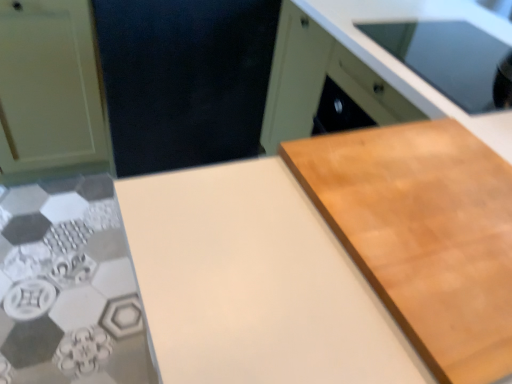
Question: Do you think white matte countertop at center is within light wood cabinet at upper right, which is counted as the second cabinetry, starting from the left, or outside of it?

Choices:
 (A) outside
 (B) inside

Answer: (A)

Question: Based on their sizes in the image, would you say white matte countertop at center is bigger or smaller than light wood cabinet at upper right, which is the 1th cabinetry in right-to-left order?

Choices:
 (A) small
 (B) big

Answer: (A)

Question: Considering the real-world distances, which object is closest to the white matte countertop at center?

Choices:
 (A) matte white cabinet at left, which is the first cabinetry from left to right
 (B) light brown wood cutting board at right
 (C) light wood cabinet at upper right, which is counted as the second cabinetry, starting from the left

Answer: (B)

Question: Estimate the real-world distances between objects in this image. Which object is closer to the light brown wood cutting board at right?

Choices:
 (A) white matte countertop at center
 (B) light wood cabinet at upper right, which is counted as the second cabinetry, starting from the left
 (C) matte white cabinet at left, the second cabinetry positioned from the right

Answer: (A)